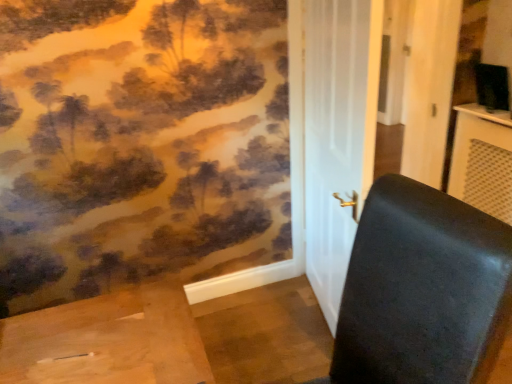
This screenshot has height=384, width=512. Describe the element at coordinates (422, 290) in the screenshot. I see `black leather chair at right` at that location.

You are a GUI agent. You are given a task and a screenshot of the screen. Output one action in this format:
    pyautogui.click(x=<x>, y=<y>)
    Task: Click on the white glossy door at center
    
    Given the screenshot: What is the action you would take?
    pyautogui.click(x=333, y=138)

From the picture: Can white glossy door at center be found inside black leather chair at right?

No, white glossy door at center is not a part of black leather chair at right.

From a real-world perspective, relative to white glossy door at center, is black leather chair at right vertically above or below?

In terms of real-world spatial position, black leather chair at right is below white glossy door at center.

Considering the relative sizes of black leather chair at right and white glossy door at center in the image provided, is black leather chair at right taller than white glossy door at center?

No.

Would you say black leather chair at right is to the left or to the right of white glossy door at center in the picture?

black leather chair at right is positioned on white glossy door at center's left side.

Which of these two, white glossy door at center or matte black table at right, is smaller?

matte black table at right is smaller.

Does white glossy door at center turn towards matte black table at right?

Yes, white glossy door at center is facing matte black table at right.

Are white glossy door at center and matte black table at right located far from each other?

Yes, white glossy door at center and matte black table at right are located far from each other.

Which is in front, black leather chair at right or matte black table at right?

Positioned in front is black leather chair at right.

From the picture: Can you confirm if black leather chair at right is wider than matte black table at right?

Correct, the width of black leather chair at right exceeds that of matte black table at right.

Is black leather chair at right directly adjacent to matte black table at right?

black leather chair at right and matte black table at right are not in contact.

Between black leather chair at right and matte black table at right, which one has larger size?

Bigger between the two is black leather chair at right.

From a real-world perspective, is white glossy door at center under black leather chair at right?

Actually, white glossy door at center is physically above black leather chair at right in the real world.

From the image's perspective, is white glossy door at center on black leather chair at right?

Correct, white glossy door at center appears higher than black leather chair at right in the image.

In terms of width, does white glossy door at center look wider or thinner when compared to black leather chair at right?

Clearly, white glossy door at center has less width compared to black leather chair at right.

In the scene shown: Is white glossy door at center positioned with its back to black leather chair at right?

That's not correct — white glossy door at center is not looking away from black leather chair at right.

Is the position of matte black table at right less distant than that of black leather chair at right?

No, matte black table at right is behind black leather chair at right.

Based on the photo, is matte black table at right facing away from black leather chair at right?

matte black table at right is not turned away from black leather chair at right.

Looking at this image, considering the positions of objects matte black table at right and black leather chair at right in the image provided, who is more to the left, matte black table at right or black leather chair at right?

From the viewer's perspective, black leather chair at right appears more on the left side.

The image size is (512, 384). Find the location of `furniture on the left of matte black table at right`. furniture on the left of matte black table at right is located at coordinates (422, 290).

You are a GUI agent. You are given a task and a screenshot of the screen. Output one action in this format:
    pyautogui.click(x=<x>, y=<y>)
    Task: Click on the screen door positioned vertically above the matte black table at right (from a real-world perspective)
    The height and width of the screenshot is (384, 512).
    Given the screenshot: What is the action you would take?
    pyautogui.click(x=333, y=138)

Is matte black table at right in front of white glossy door at center?

No, matte black table at right is behind white glossy door at center.

Based on the photo, does matte black table at right appear on the right side of white glossy door at center?

Yes.

From a real-world perspective, is matte black table at right physically located above or below white glossy door at center?

Clearly, from a real-world perspective, matte black table at right is below white glossy door at center.

Where is `furniture in front of the white glossy door at center`? The image size is (512, 384). furniture in front of the white glossy door at center is located at coordinates (422, 290).

Identify the location of screen door above the matte black table at right (from a real-world perspective). The image size is (512, 384). (333, 138).

From the image, which object appears to be nearer to matte black table at right, black leather chair at right or white glossy door at center?

Among the two, white glossy door at center is located nearer to matte black table at right.

Considering their positions, is matte black table at right positioned closer to black leather chair at right than white glossy door at center?

white glossy door at center is positioned closer to the anchor black leather chair at right.

When comparing their distances from black leather chair at right, does white glossy door at center or matte black table at right seem further?

matte black table at right.

From the image, which object appears to be nearer to white glossy door at center, black leather chair at right or matte black table at right?

The object closer to white glossy door at center is black leather chair at right.

Which object lies further to the anchor point white glossy door at center, matte black table at right or black leather chair at right?

The object further to white glossy door at center is matte black table at right.

Estimate the real-world distances between objects in this image. Which object is further from matte black table at right, white glossy door at center or black leather chair at right?

black leather chair at right lies further to matte black table at right than the other object.

This screenshot has height=384, width=512. I want to click on screen door located between black leather chair at right and matte black table at right in the depth direction, so click(x=333, y=138).